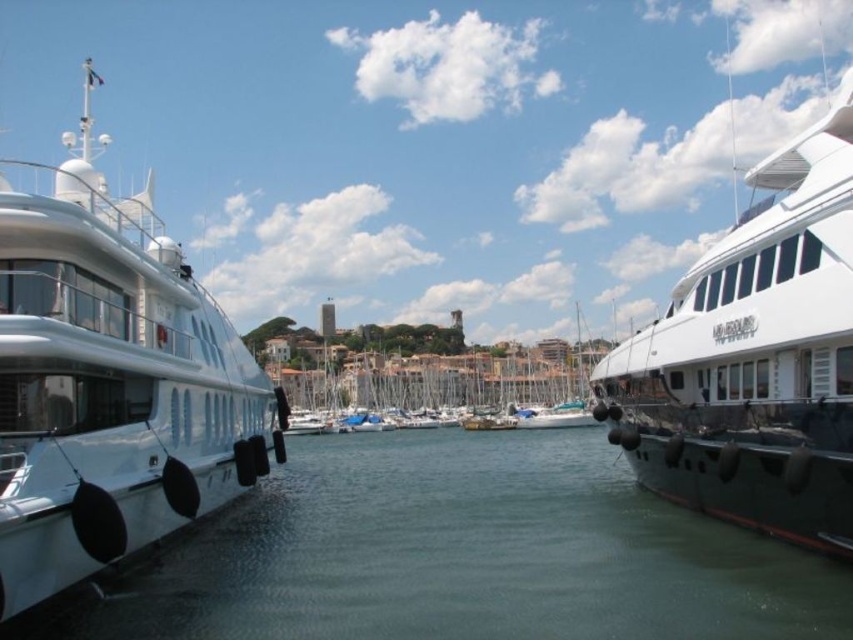
Question: Is clear water at center above white glossy yacht at left?

Choices:
 (A) no
 (B) yes

Answer: (A)

Question: Does clear water at center appear on the left side of white glossy yacht at left?

Choices:
 (A) no
 (B) yes

Answer: (A)

Question: Which point is closer to the camera?

Choices:
 (A) white glossy yacht at left
 (B) clear water at center

Answer: (A)

Question: Can you confirm if clear water at center is bigger than white glossy yacht at left?

Choices:
 (A) no
 (B) yes

Answer: (A)